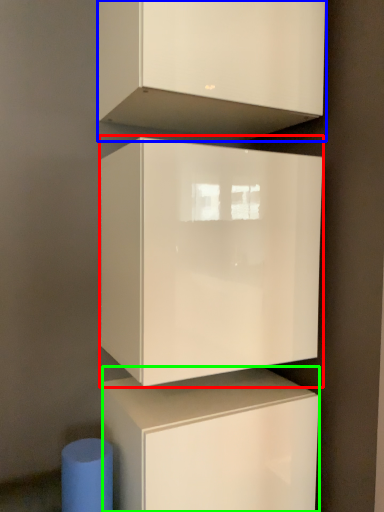
Question: Which is nearer to the cabinetry (highlighted by a red box)? cabinetry (highlighted by a blue box) or cabinetry (highlighted by a green box).

Choices:
 (A) cabinetry
 (B) cabinetry

Answer: (B)